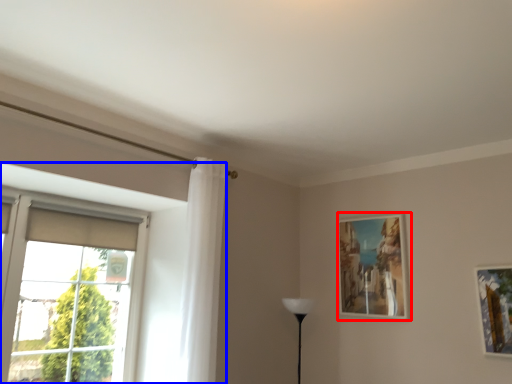
Question: Among these objects, which one is nearest to the camera, picture frame (highlighted by a red box) or window (highlighted by a blue box)?

Choices:
 (A) picture frame
 (B) window

Answer: (B)